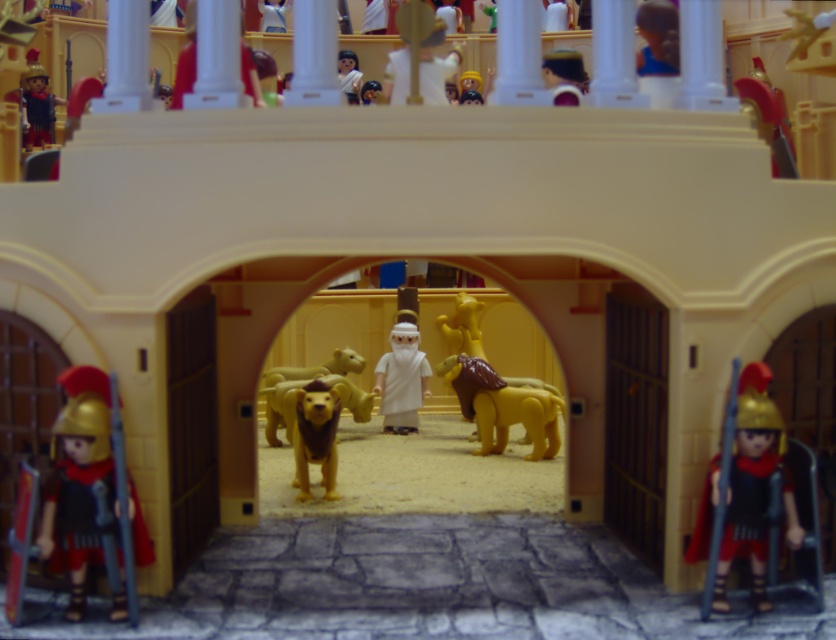
Question: Which object appears farthest from the camera in this image?

Choices:
 (A) smooth gold coin at center
 (B) matte black helmet at upper left
 (C) smooth blue shirt at upper center

Answer: (A)

Question: Which point is closer to the camera?

Choices:
 (A) [660, 60]
 (B) [44, 81]
 (C) [439, 372]

Answer: (A)

Question: Does yellow plush lion at center appear under smooth gold coin at center?

Choices:
 (A) yes
 (B) no

Answer: (A)

Question: Observing the image, what is the correct spatial positioning of smooth yellow lion at center in reference to light brown plush lion at center?

Choices:
 (A) right
 (B) left

Answer: (A)

Question: Which point is farther from the camera taking this photo?

Choices:
 (A) (653, 0)
 (B) (293, 401)
 (C) (312, 452)
 (D) (753, 378)

Answer: (B)

Question: Can you confirm if white matte toga at center is positioned above smooth blue shirt at upper center?

Choices:
 (A) no
 (B) yes

Answer: (A)